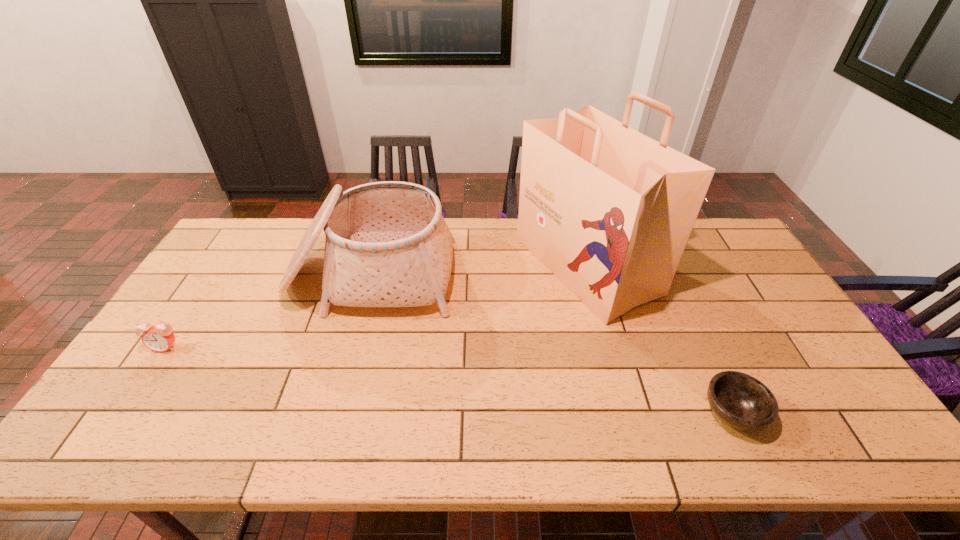
The height and width of the screenshot is (540, 960). In order to click on free location located with the lid open on the second object from left to right in this screenshot , I will do `click(347, 358)`.

Find the location of a particular element. free space located on the clock face of the second nearest object is located at coordinates (137, 388).

The height and width of the screenshot is (540, 960). Identify the location of vacant region located 0.290m on the back of the shortest object. (682, 305).

Where is `grocery bag located at the far edge`? This screenshot has height=540, width=960. grocery bag located at the far edge is located at coordinates (609, 211).

This screenshot has height=540, width=960. In order to click on basket present at the far edge in this screenshot , I will do `click(387, 244)`.

At what (x,y) coordinates should I click in order to perform the action: click on object that is at the near edge. Please return your answer as a coordinate pair (x, y). Image resolution: width=960 pixels, height=540 pixels. Looking at the image, I should click on (741, 401).

The width and height of the screenshot is (960, 540). I want to click on object that is at the left edge, so click(x=159, y=338).

In the image, there is a desktop. Where is `vacant space at the far edge`? This screenshot has height=540, width=960. vacant space at the far edge is located at coordinates click(483, 225).

At what (x,y) coordinates should I click in order to perform the action: click on vacant space at the near edge of the desktop. Please return your answer as a coordinate pair (x, y). Looking at the image, I should click on (454, 422).

Find the location of `vacant space at the left edge of the desktop`. vacant space at the left edge of the desktop is located at coordinates (120, 390).